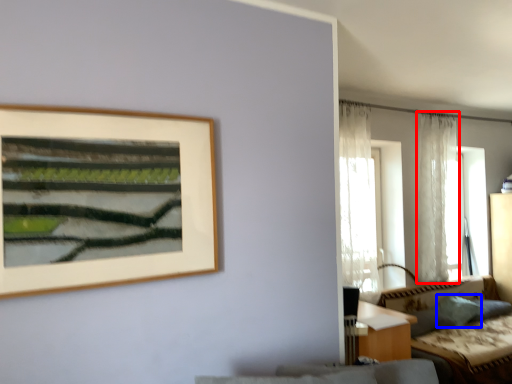
Question: Which of the following is the farthest to the observer, curtain (highlighted by a red box) or pillow (highlighted by a blue box)?

Choices:
 (A) curtain
 (B) pillow

Answer: (A)